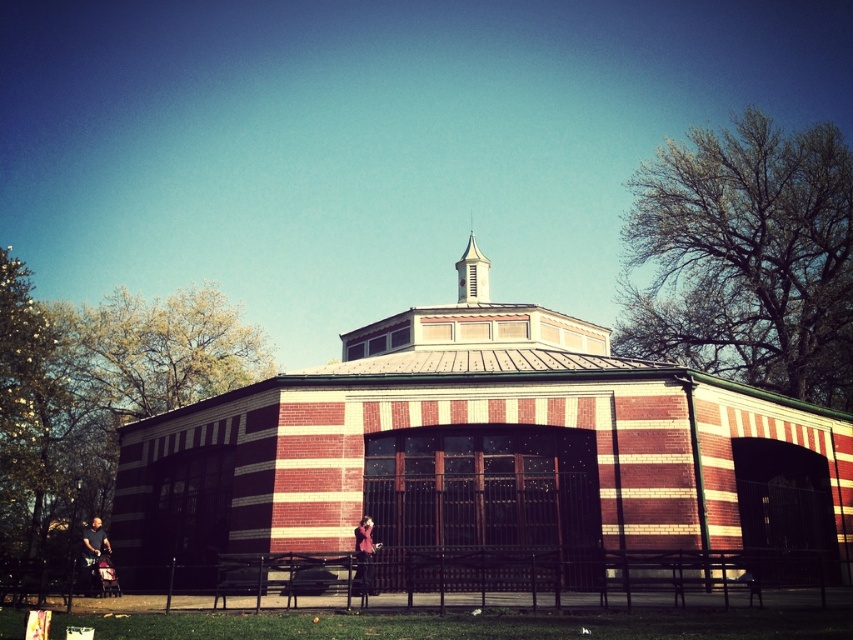
Question: Estimate the real-world distances between objects in this image. Which object is farther from the white stucco spire at upper center?

Choices:
 (A) black metal picnic table at center
 (B) red brick church at center

Answer: (A)

Question: Can you confirm if red brick church at center is thinner than white stucco spire at upper center?

Choices:
 (A) no
 (B) yes

Answer: (A)

Question: Among these points, which one is farthest from the camera?

Choices:
 (A) (381, 461)
 (B) (312, 593)

Answer: (A)

Question: Which object appears closest to the camera in this image?

Choices:
 (A) black metal picnic table at center
 (B) red brick church at center

Answer: (B)

Question: Is red brick church at center to the left of white stucco spire at upper center from the viewer's perspective?

Choices:
 (A) yes
 (B) no

Answer: (A)

Question: Can you confirm if red brick church at center is smaller than black metal picnic table at center?

Choices:
 (A) no
 (B) yes

Answer: (A)